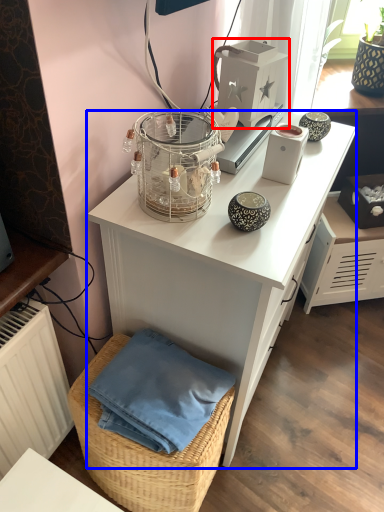
Question: Which point is closer to the camera, appliance (highlighted by a red box) or desk (highlighted by a blue box)?

Choices:
 (A) appliance
 (B) desk

Answer: (B)